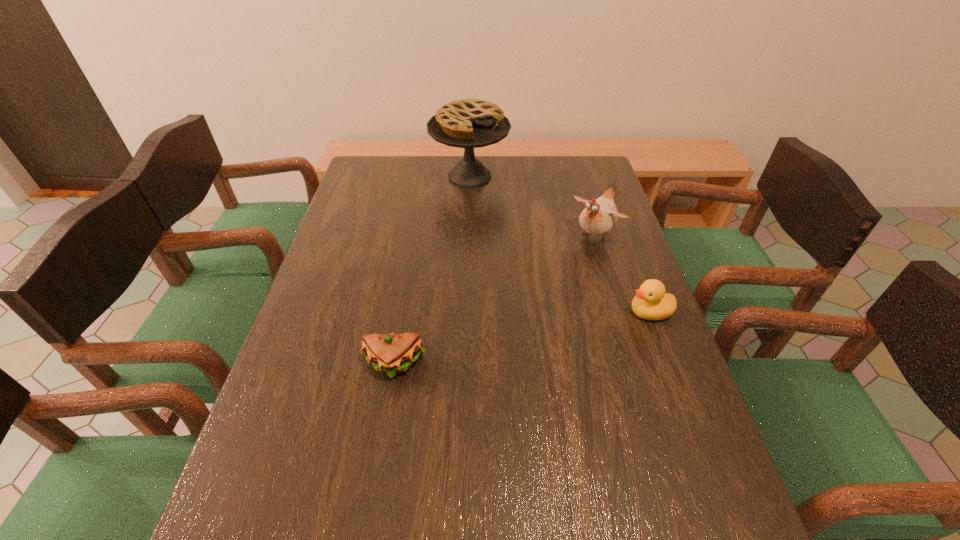
This screenshot has height=540, width=960. Find the location of `empty space that is in between the third shortest object and the second nearest object`. empty space that is in between the third shortest object and the second nearest object is located at coordinates (623, 274).

Image resolution: width=960 pixels, height=540 pixels. I want to click on empty location between the bird and the sandwich, so click(x=495, y=301).

Find the location of `free area in between the second tallest object and the nearest object`. free area in between the second tallest object and the nearest object is located at coordinates (495, 301).

This screenshot has height=540, width=960. I want to click on unoccupied area between the duckling and the third shortest object, so click(623, 274).

The image size is (960, 540). Identify the location of blank region between the nearest object and the duckling. (521, 339).

In order to click on the closest object relative to the pie in this screenshot , I will do `click(600, 216)`.

Select which object appears as the closest to the third farthest object. Please provide its 2D coordinates. Your answer should be formatted as a tuple, i.e. [(x, y)], where the tuple contains the x and y coordinates of a point satisfying the conditions above.

[(600, 216)]

The width and height of the screenshot is (960, 540). What are the coordinates of `blank space that satisfies the following two spatial constraints: 1. on the back side of the second nearest object; 2. on the face of the sandwich` in the screenshot? It's located at (403, 312).

Locate an element on the screen. Image resolution: width=960 pixels, height=540 pixels. free location that satisfies the following two spatial constraints: 1. on the front side of the second farthest object; 2. on the face of the duckling is located at coordinates (618, 312).

At what (x,y) coordinates should I click in order to perform the action: click on free space that satisfies the following two spatial constraints: 1. on the front side of the bird; 2. on the face of the duckling. Please return your answer as a coordinate pair (x, y). Looking at the image, I should click on click(618, 312).